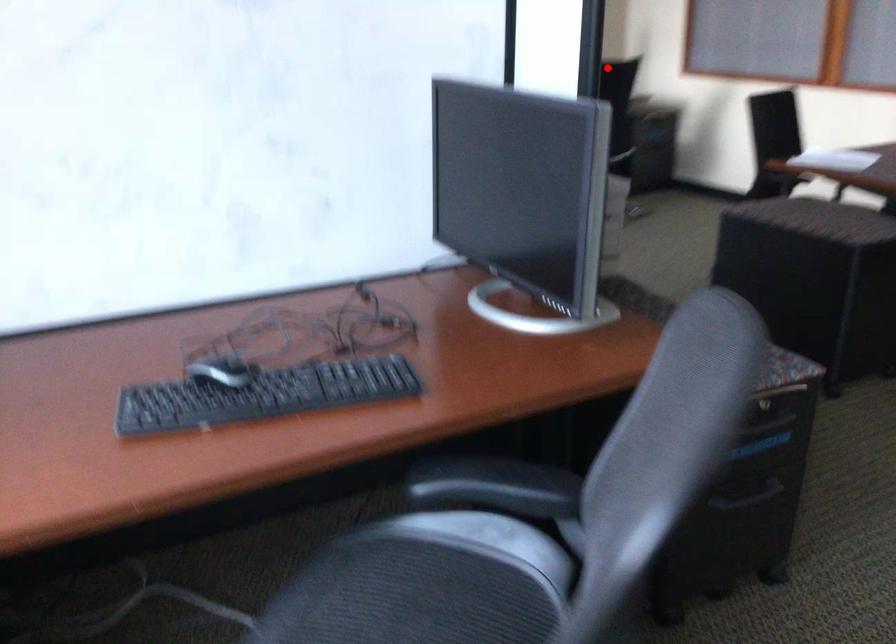
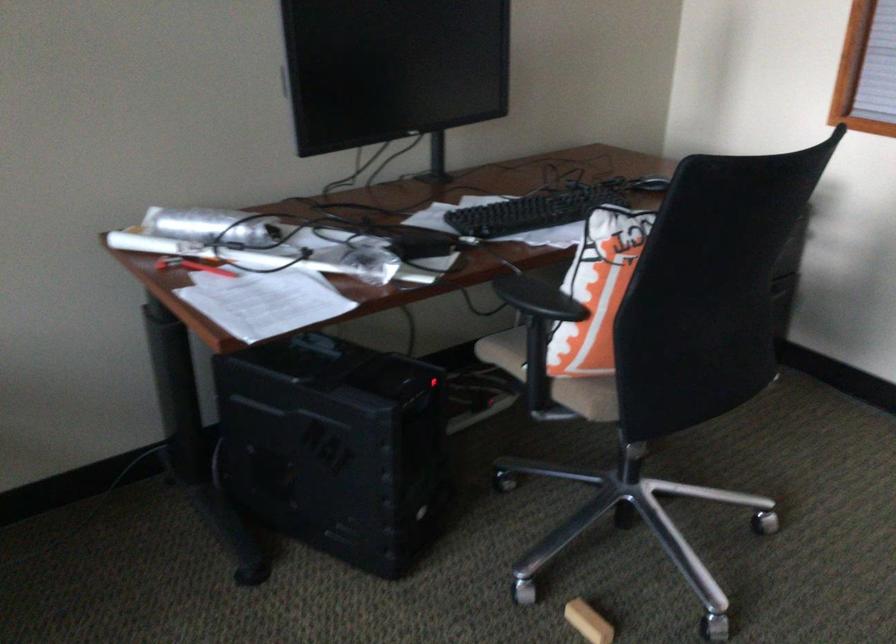
Locate, in the second image, the point that corresponds to the highlighted location in the first image.

(597, 290)